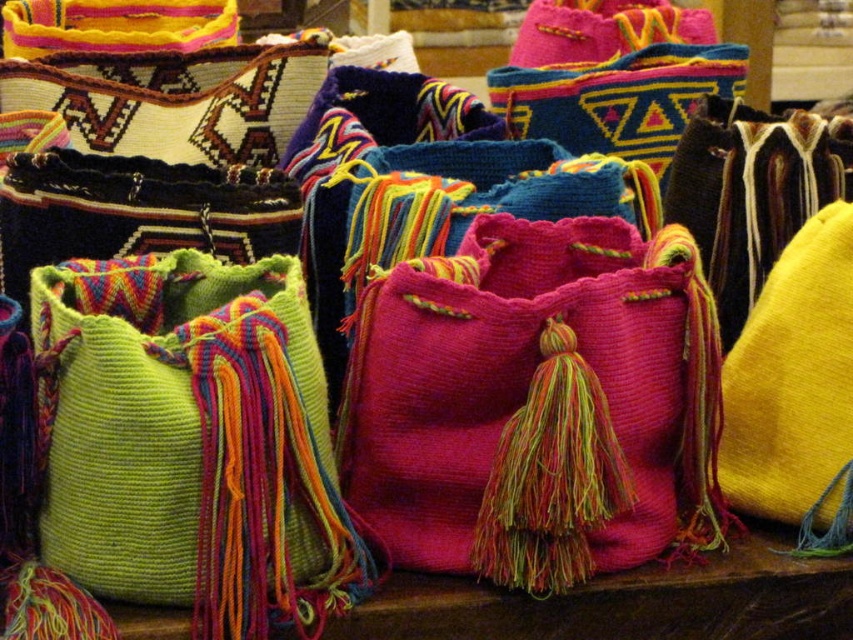
From the picture: You are an interior designer planning to place the fuzzy pink bag at center and the yellow fabric pillow at right on a shelf. Which object should you place first to ensure they both fit on the shelf?

The fuzzy pink bag at center is larger than the yellow fabric pillow at right, so you should place the fuzzy pink bag at center first to ensure proper placement and that both fit on the shelf.

You are at a market and want to place the fuzzy pink bag at center and the yellow fabric pillow at right on a shelf. Based on their heights, which one should you place first to ensure stability?

The fuzzy pink bag at center is taller than the yellow fabric pillow at right, so you should place the fuzzy pink bag at center first to ensure stability.

You are shopping at a market and see the fuzzy pink bag at center and the yellow fabric pillow at right. Which item is positioned lower in the image?

The fuzzy pink bag at center is positioned lower than the yellow fabric pillow at right.